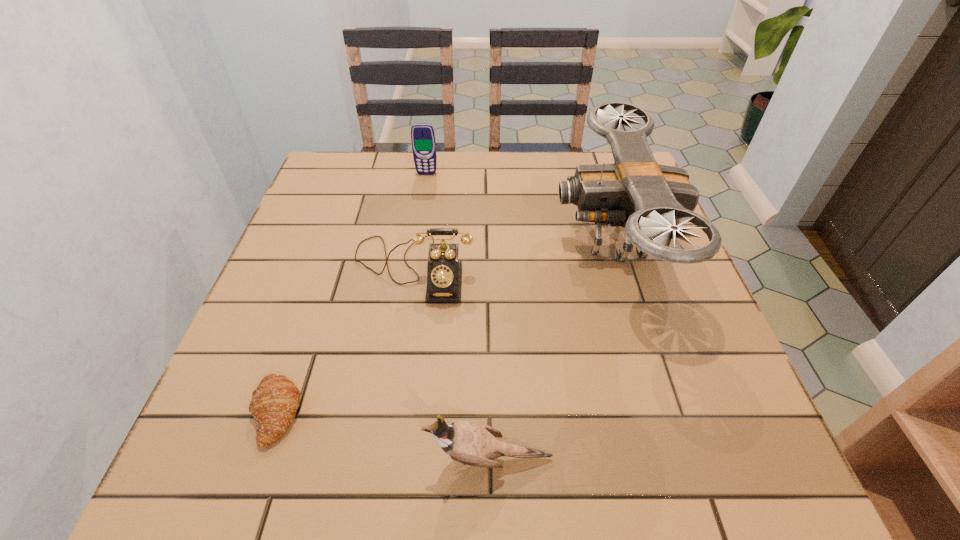
What are the coordinates of `vacant region located 0.310m on the front-facing side of the cellular telephone` in the screenshot? It's located at (416, 248).

The width and height of the screenshot is (960, 540). I want to click on free space located at the face of the bird, so click(x=232, y=458).

Where is `vacant space located 0.210m at the face of the bird`? The image size is (960, 540). vacant space located 0.210m at the face of the bird is located at coordinates (295, 458).

What are the coordinates of `vacant space located at the face of the bird` in the screenshot? It's located at (220, 458).

The image size is (960, 540). I want to click on free spot located 0.100m on the dial of the telephone, so click(x=401, y=345).

Identify the location of vacant region located 0.370m on the back of the crescent roll. Image resolution: width=960 pixels, height=540 pixels. (335, 244).

Where is `drone located at the far edge`? This screenshot has width=960, height=540. drone located at the far edge is located at coordinates coord(650,200).

Find the location of a particular element. The image size is (960, 540). cellular telephone at the far edge is located at coordinates (423, 141).

You are a GUI agent. You are given a task and a screenshot of the screen. Output one action in this format:
    pyautogui.click(x=<x>, y=<y>)
    Task: Click on the bird present at the near edge
    The height and width of the screenshot is (540, 960).
    Given the screenshot: What is the action you would take?
    pyautogui.click(x=475, y=444)

This screenshot has width=960, height=540. Identify the location of crescent roll that is at the near edge. (273, 406).